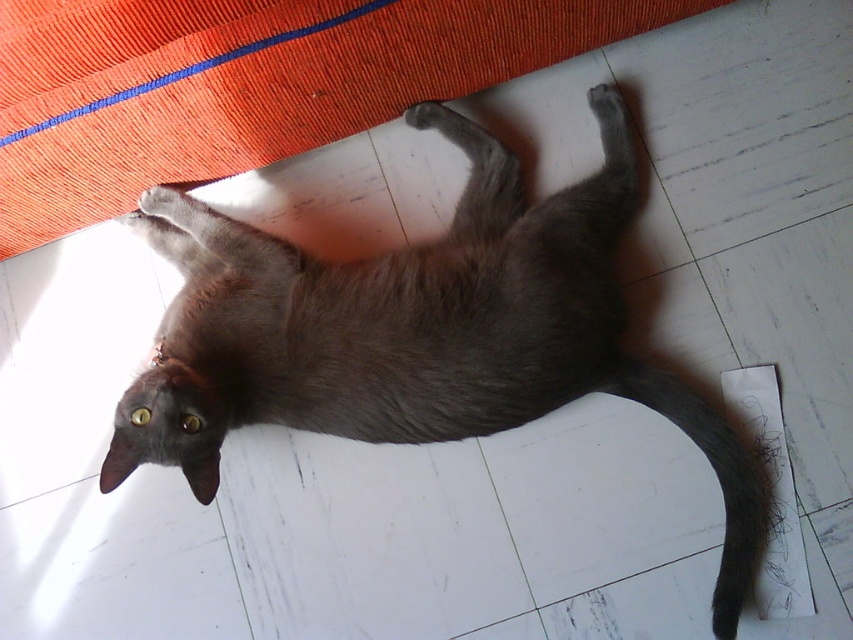
Does gray fur cat at center appear on the right side of gray fur tail at lower right?

Incorrect, gray fur cat at center is not on the right side of gray fur tail at lower right.

Find the location of a particular element. gray fur cat at center is located at coordinates (418, 332).

Image resolution: width=853 pixels, height=640 pixels. Find the location of `gray fur cat at center`. gray fur cat at center is located at coordinates (418, 332).